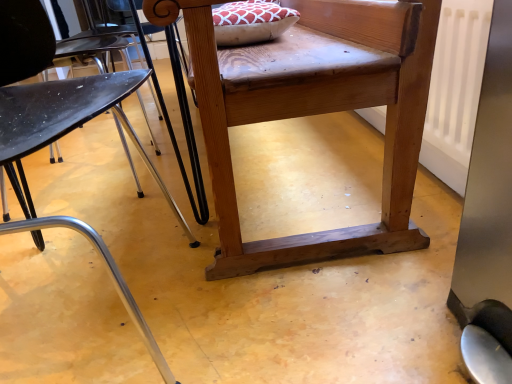
At what (x,y) coordinates should I click in order to perform the action: click on vacant space underneath metallic black chair at left (from a real-world perspective). Please return your answer as a coordinate pair (x, y). This screenshot has width=512, height=384. Looking at the image, I should click on (80, 314).